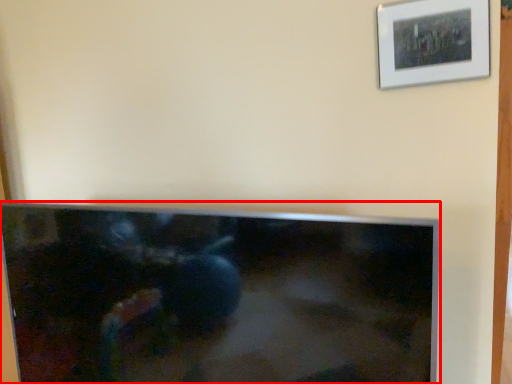
Question: Observing the image, what is the correct spatial positioning of television (annotated by the red box) in reference to picture frame?

Choices:
 (A) right
 (B) left

Answer: (B)